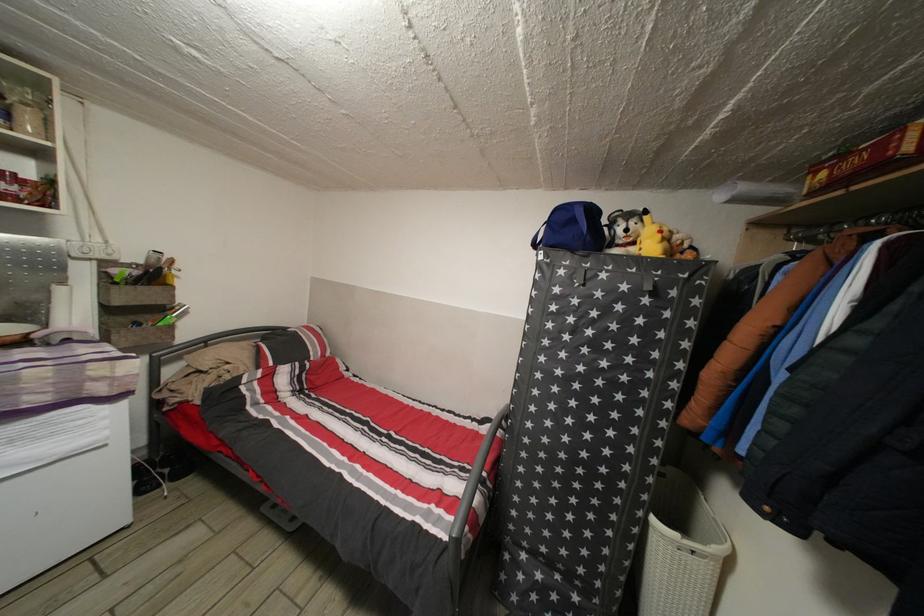
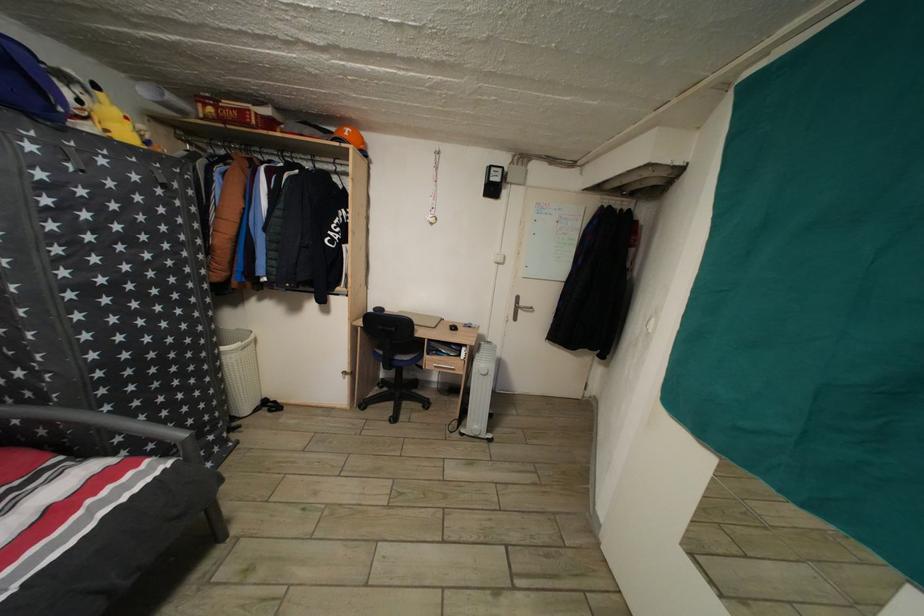
The point at (667, 238) is marked in the first image. Where is the corresponding point in the second image?

(134, 124)